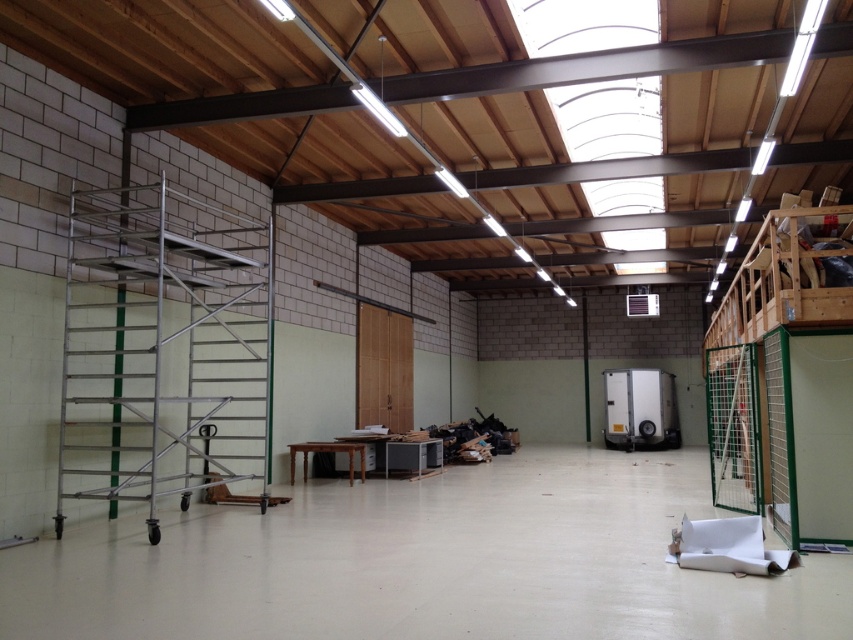
From the picture: Can you confirm if silver metallic scaffolding at left is shorter than metallic gray printer at center?

No, silver metallic scaffolding at left is not shorter than metallic gray printer at center.

Between point (167, 493) and point (433, 458), which one is positioned behind?

The point (433, 458) is behind.

Which is behind, point (158, 404) or point (390, 452)?

The point (390, 452) is more distant.

Identify the location of silver metallic scaffolding at left. (161, 348).

Is white glossy refrigerator at center thinner than metallic gray printer at center?

Incorrect, white glossy refrigerator at center's width is not less than metallic gray printer at center's.

Does white glossy refrigerator at center come behind metallic gray printer at center?

Yes, it is.

Which is behind, point (635, 444) or point (421, 472)?

Point (635, 444)

Where is `white glossy refrigerator at center`? The image size is (853, 640). white glossy refrigerator at center is located at coordinates (639, 408).

Which is below, silver metallic scaffolding at left or white glossy refrigerator at center?

Positioned lower is white glossy refrigerator at center.

Is silver metallic scaffolding at left positioned in front of white glossy refrigerator at center?

Yes, it is in front of white glossy refrigerator at center.

This screenshot has height=640, width=853. Describe the element at coordinates (161, 348) in the screenshot. I see `silver metallic scaffolding at left` at that location.

Where is `silver metallic scaffolding at left`? The image size is (853, 640). silver metallic scaffolding at left is located at coordinates (161, 348).